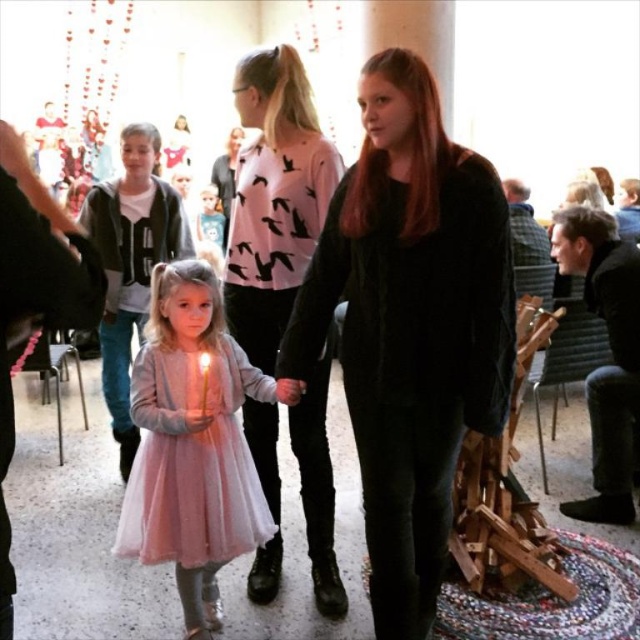
Question: Does pink matte sweater at center come in front of pastel pink tulle dress at center?

Choices:
 (A) yes
 (B) no

Answer: (A)

Question: Which point is farther to the camera?

Choices:
 (A) black fuzzy coat at center
 (B) pastel pink tulle dress at center
 (C) pink matte sweater at center

Answer: (B)

Question: Can you confirm if black fuzzy coat at center is thinner than pink matte sweater at center?

Choices:
 (A) yes
 (B) no

Answer: (B)

Question: Does pink matte sweater at center appear over pastel pink tulle dress at center?

Choices:
 (A) yes
 (B) no

Answer: (A)

Question: Which is farther from the pastel pink tulle dress at center?

Choices:
 (A) pink matte sweater at center
 (B) light pink tulle dress at center

Answer: (B)

Question: Which point is closer to the camera?

Choices:
 (A) light pink tulle dress at center
 (B) pink matte sweater at center

Answer: (B)